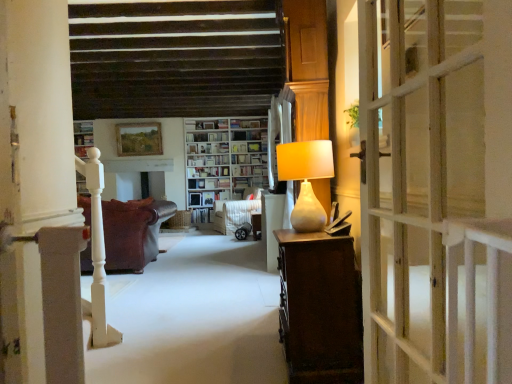
Question: Is matte beige lamp at right to the left or to the right of velvet brown armchair at center in the image?

Choices:
 (A) left
 (B) right

Answer: (B)

Question: From a real-world perspective, is matte beige lamp at right above or below velvet brown armchair at center?

Choices:
 (A) below
 (B) above

Answer: (B)

Question: Estimate the real-world distances between objects in this image. Which object is farther from the hardcover book at center, the 3th book from the top?

Choices:
 (A) hardcover book at center, the 2th book positioned from the bottom
 (B) leather couch at left
 (C) white glossy bookshelf at center, placed as the 1th shelf when sorted from left to right
 (D) white wooden door at right
 (E) white glossy bookshelf at center, the second shelf from the top

Answer: (D)

Question: Estimate the real-world distances between objects in this image. Which object is closer to the wooden side table at center?

Choices:
 (A) hardcover book at center, the first book viewed from the top
 (B) white glossy bookshelf at center, the second shelf from the top
 (C) velvet brown armchair at center
 (D) wooden picture frame at upper center
 (E) hardcover book at center, acting as the first book starting from the bottom

Answer: (C)